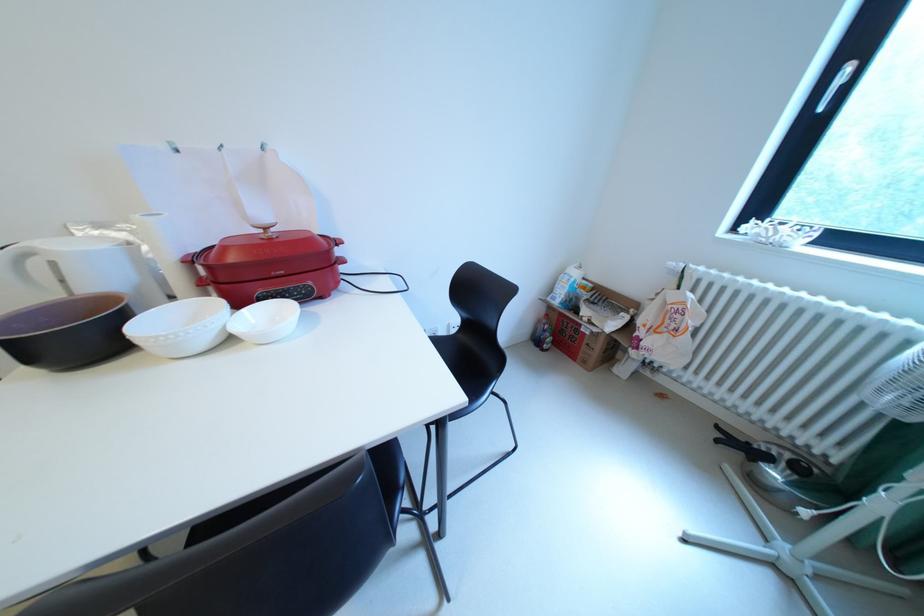
Image resolution: width=924 pixels, height=616 pixels. Identify the location of window handle. (847, 84).